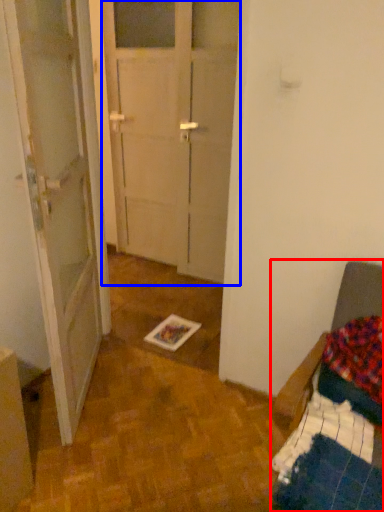
Question: Which object is further to the camera taking this photo, furniture (highlighted by a red box) or glass door (highlighted by a blue box)?

Choices:
 (A) furniture
 (B) glass door

Answer: (B)